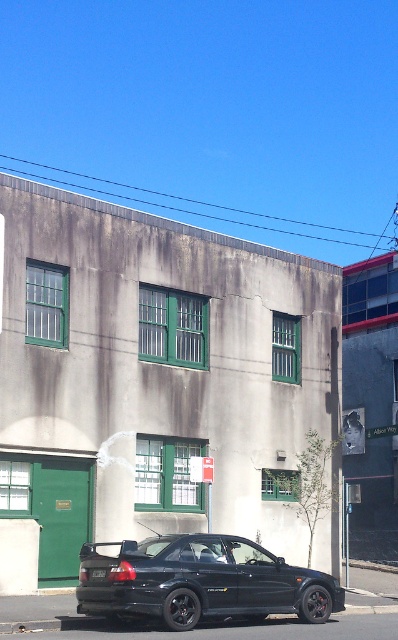
You are a delivery person trying to park your truck next to the matte black car at lower center. The truck requires a space that is wider than the black plastic license plate at center. Can you park your truck here?

The matte black car at lower center is wider than the black plastic license plate at center, so the truck can park here as the space is wider than the license plate.

You are a delivery person who needs to park your vehicle in front of the two story building. The parking space is only wide enough for a single car. There is a matte black car at lower center and a black plastic license plate at center. Can you park your car between them without overlapping either?

The matte black car at lower center is positioned on the right side of the black plastic license plate at center, so parking between them would require placing your vehicle between the two objects. However, since the parking space is only wide enough for a single car, there is insufficient space to fit another vehicle between them without overlapping.

You are a delivery person approaching the building and need to park your vehicle. The matte black car at lower center is blocking the entrance. Can you see the black plastic license plate at center clearly from your current position?

The matte black car at lower center is closer to the viewer than the black plastic license plate at center, so the license plate is further away and might not be clearly visible from your current position.